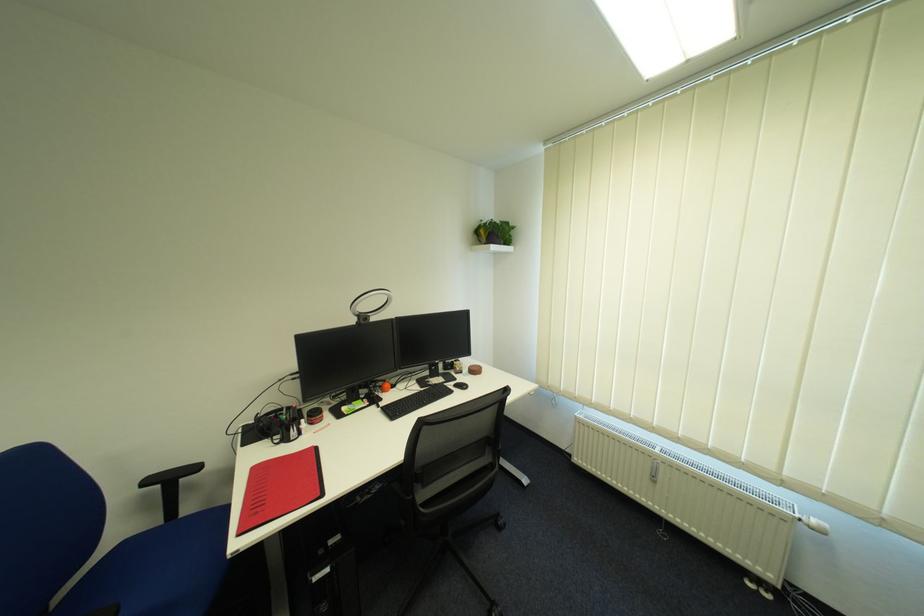
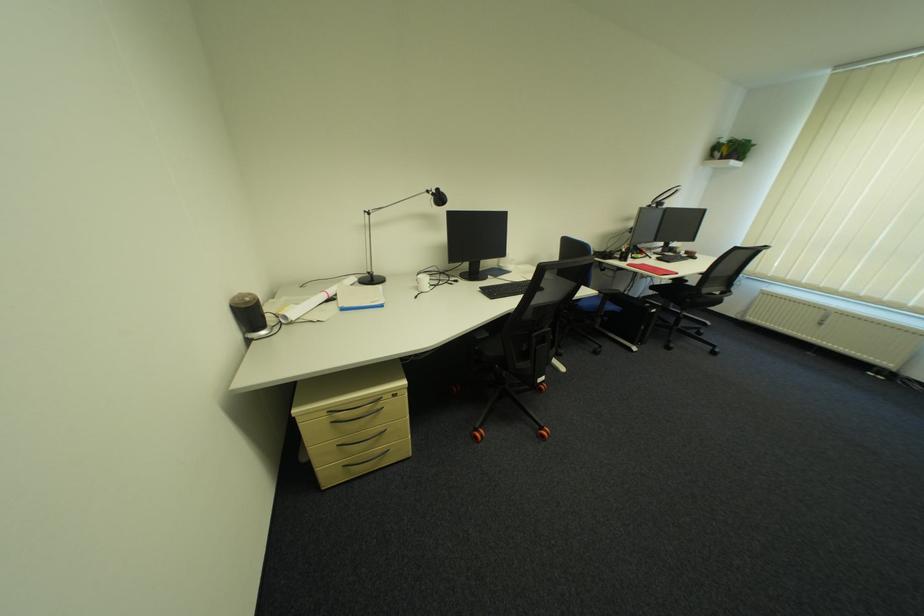
The point at (423, 501) is marked in the first image. Where is the corresponding point in the second image?

(711, 291)